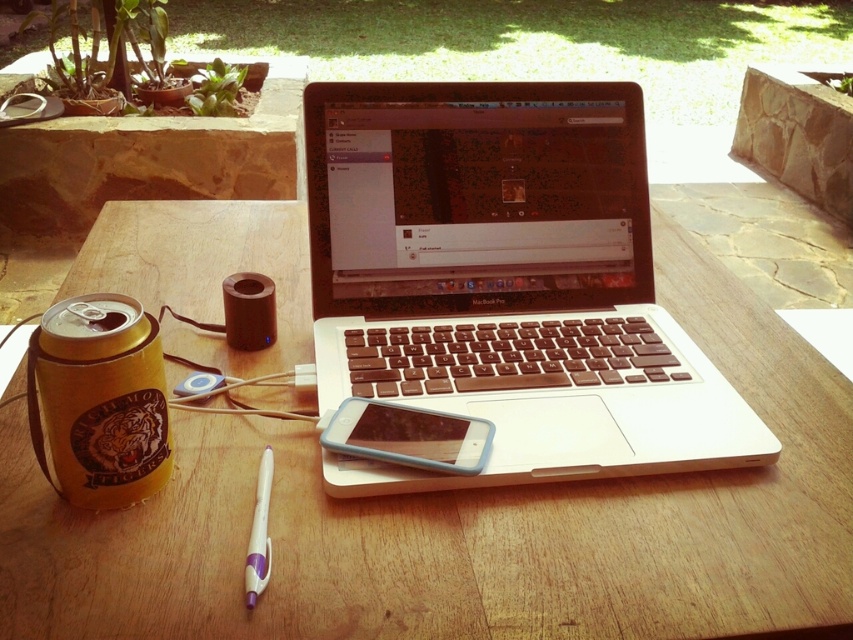
Between wooden table at center and gold leather can at left, which one is positioned higher?

wooden table at center is above.

Where is `wooden table at center`? The image size is (853, 640). wooden table at center is located at coordinates (468, 524).

Identify the location of wooden table at center. This screenshot has height=640, width=853. (468, 524).

Is point (160, 384) less distant than point (448, 422)?

Yes, it is in front of point (448, 422).

Who is shorter, gold leather can at left or translucent plastic phone at center?

With less height is translucent plastic phone at center.

Is point (132, 426) farther from camera compared to point (457, 420)?

No, (132, 426) is closer to viewer.

This screenshot has width=853, height=640. What are the coordinates of `gold leather can at left` in the screenshot? It's located at (99, 401).

Is wooden table at center in front of white plastic pen at lower center?

Yes, wooden table at center is closer to the viewer.

Can you confirm if wooden table at center is wider than white plastic pen at lower center?

Indeed, wooden table at center has a greater width compared to white plastic pen at lower center.

Is point (648, 608) less distant than point (260, 461)?

Yes, it is in front of point (260, 461).

You are a GUI agent. You are given a task and a screenshot of the screen. Output one action in this format:
    pyautogui.click(x=<x>, y=<y>)
    Task: Click on the wooden table at center
    
    Given the screenshot: What is the action you would take?
    pyautogui.click(x=468, y=524)